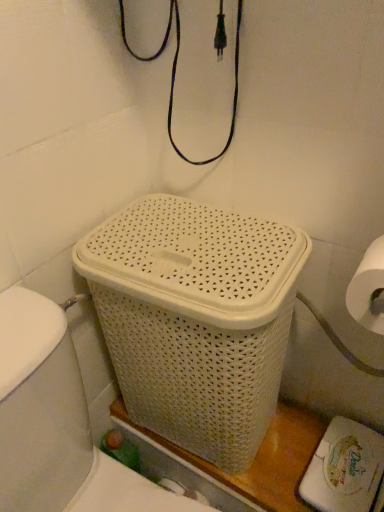
What do you see at coordinates (195, 319) in the screenshot? The height and width of the screenshot is (512, 384). I see `white woven basket at center` at bounding box center [195, 319].

This screenshot has height=512, width=384. In order to click on white woven basket at center in this screenshot , I will do `click(195, 319)`.

The width and height of the screenshot is (384, 512). What do you see at coordinates (57, 423) in the screenshot? I see `white woven laundry basket at center` at bounding box center [57, 423].

The width and height of the screenshot is (384, 512). What are the coordinates of `white woven laundry basket at center` in the screenshot? It's located at coord(57,423).

Locate an element on the screen. Image resolution: width=384 pixels, height=512 pixels. white woven basket at center is located at coordinates (195, 319).

Considering the relative positions of white woven basket at center and white woven laundry basket at center in the image provided, is white woven basket at center to the right of white woven laundry basket at center from the viewer's perspective?

Indeed, white woven basket at center is positioned on the right side of white woven laundry basket at center.

Which is in front, white woven basket at center or white woven laundry basket at center?

white woven laundry basket at center is closer to the camera.

Is point (195, 438) positioned after point (82, 383)?

Yes, point (195, 438) is behind point (82, 383).

From the image's perspective, is white woven basket at center above white woven laundry basket at center?

Yes, from the image's perspective, white woven basket at center is above white woven laundry basket at center.

From a real-world perspective, is white woven basket at center positioned above or below white woven laundry basket at center?

From a real-world perspective, white woven basket at center is physically above white woven laundry basket at center.

Considering the sizes of objects white woven basket at center and white woven laundry basket at center in the image provided, who is wider, white woven basket at center or white woven laundry basket at center?

white woven laundry basket at center.

Can you confirm if white woven basket at center is taller than white woven laundry basket at center?

No, white woven basket at center is not taller than white woven laundry basket at center.

Does white woven basket at center have a smaller size compared to white woven laundry basket at center?

Yes, white woven basket at center is smaller than white woven laundry basket at center.

From the picture: Would you say white woven basket at center is inside or outside white woven laundry basket at center?

white woven basket at center is spatially situated outside white woven laundry basket at center.

Is white woven basket at center placed right next to white woven laundry basket at center?

white woven basket at center and white woven laundry basket at center are clearly separated.

Is white woven basket at center oriented away from white woven laundry basket at center?

white woven basket at center does not have its back to white woven laundry basket at center.

Can you tell me how much white woven basket at center and white woven laundry basket at center differ in facing direction?

The facing directions of white woven basket at center and white woven laundry basket at center are 85.9 degrees apart.

At what (x,y) coordinates should I click in order to perform the action: click on sink in front of the white woven basket at center. Please return your answer as a coordinate pair (x, y). The height and width of the screenshot is (512, 384). Looking at the image, I should click on (57, 423).

Can you confirm if white woven laundry basket at center is positioned to the left of white woven basket at center?

Yes, white woven laundry basket at center is to the left of white woven basket at center.

Considering the positions of objects white woven laundry basket at center and white woven basket at center in the image provided, who is behind, white woven laundry basket at center or white woven basket at center?

white woven basket at center.

Is point (70, 493) less distant than point (139, 326)?

Yes, point (70, 493) is in front of point (139, 326).

From the image's perspective, is white woven laundry basket at center on top of white woven basket at center?

No, from the image's perspective, white woven laundry basket at center is not over white woven basket at center.

From a real-world perspective, is white woven laundry basket at center located higher than white woven basket at center?

Actually, white woven laundry basket at center is physically below white woven basket at center in the real world.

Is white woven laundry basket at center thinner than white woven basket at center?

Incorrect, the width of white woven laundry basket at center is not less than that of white woven basket at center.

Which of these two, white woven laundry basket at center or white woven basket at center, stands shorter?

white woven basket at center.

Who is smaller, white woven laundry basket at center or white woven basket at center?

Smaller between the two is white woven basket at center.

Is white woven basket at center completely or partially inside white woven laundry basket at center?

Actually, white woven basket at center is outside white woven laundry basket at center.

Is there a large distance between white woven laundry basket at center and white woven basket at center?

white woven laundry basket at center is near white woven basket at center, not far away.

Could you tell me if white woven laundry basket at center is turned towards white woven basket at center?

No, white woven laundry basket at center is not aimed at white woven basket at center.

Can you tell me how much white woven laundry basket at center and white woven basket at center differ in facing direction?

85.9 degrees.

The height and width of the screenshot is (512, 384). In order to click on sink on the left of white woven basket at center in this screenshot , I will do `click(57, 423)`.

The image size is (384, 512). What are the coordinates of `sink that is in front of the white woven basket at center` in the screenshot? It's located at (57, 423).

Where is `sink below the white woven basket at center (from a real-world perspective)`? Image resolution: width=384 pixels, height=512 pixels. sink below the white woven basket at center (from a real-world perspective) is located at coordinates (57, 423).